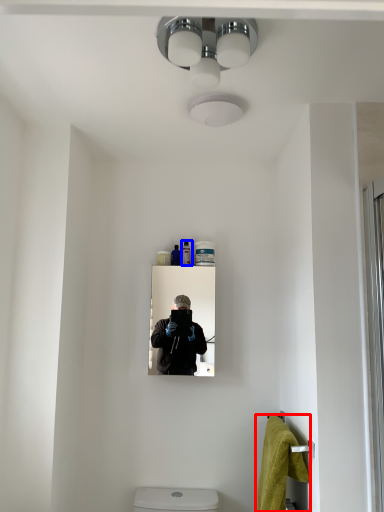
Question: Which object appears closest to the camera in this image, bath towel (highlighted by a red box) or toiletry (highlighted by a blue box)?

Choices:
 (A) bath towel
 (B) toiletry

Answer: (A)